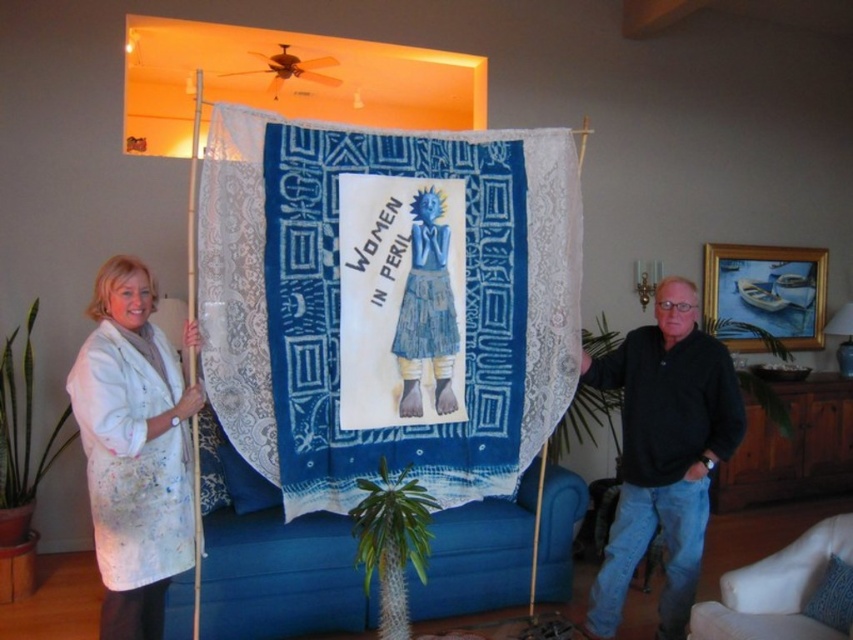
You are a delivery person who needs to place a small package between the white paint splattered coat at left and the black cotton shirt at right. The package is 2 feet long. Can you fit it between them?

The white paint splattered coat at left is 5.83 feet away from the black cotton shirt at right. Since the package is only 2 feet long, there is sufficient space between them to place the package.

You are an interior designer assessing the living room scene. You notice the white paint splattered coat at left and the white fabric couch at lower right. Based on their sizes, which object would you recommend placing in a smaller space to maintain a balanced aesthetic?

The white fabric couch at lower right is smaller in size, making it more suitable for a smaller space to maintain a balanced aesthetic.